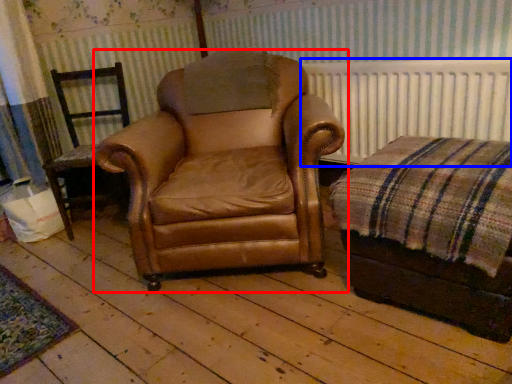
Question: Which of the following is the farthest to the observer, chair (highlighted by a red box) or radiator (highlighted by a blue box)?

Choices:
 (A) chair
 (B) radiator

Answer: (B)